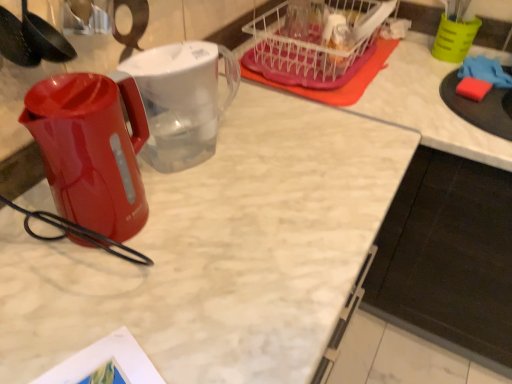
The height and width of the screenshot is (384, 512). Identify the location of unoccupied region to the right of translucent plastic basket at upper right. (420, 70).